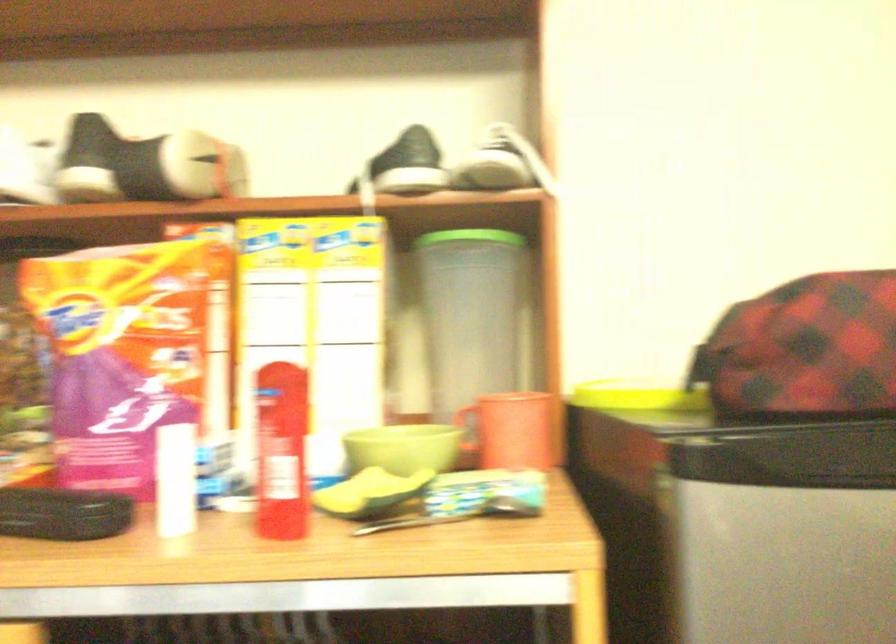
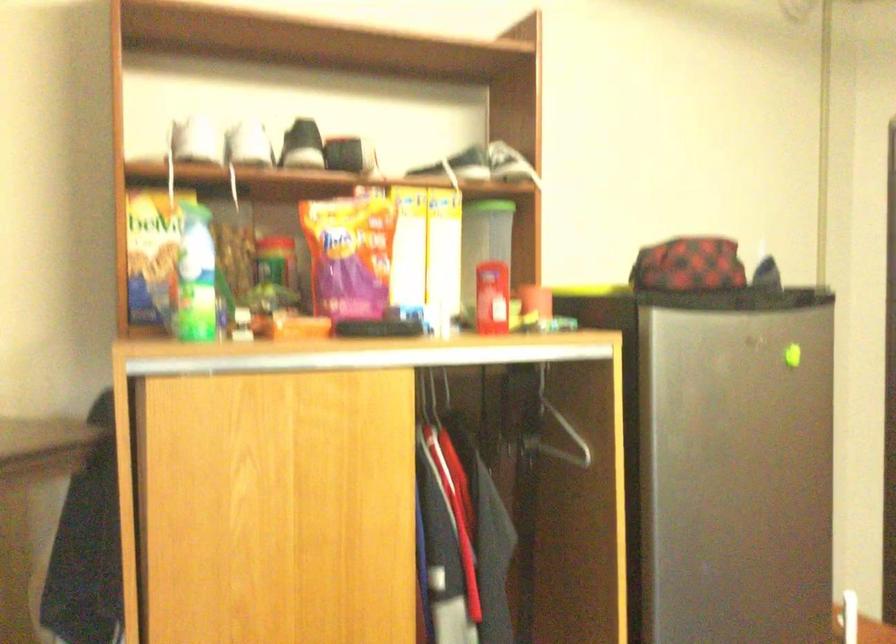
Where in the second image is the point corresponding to point (315, 332) from the first image?

(426, 251)